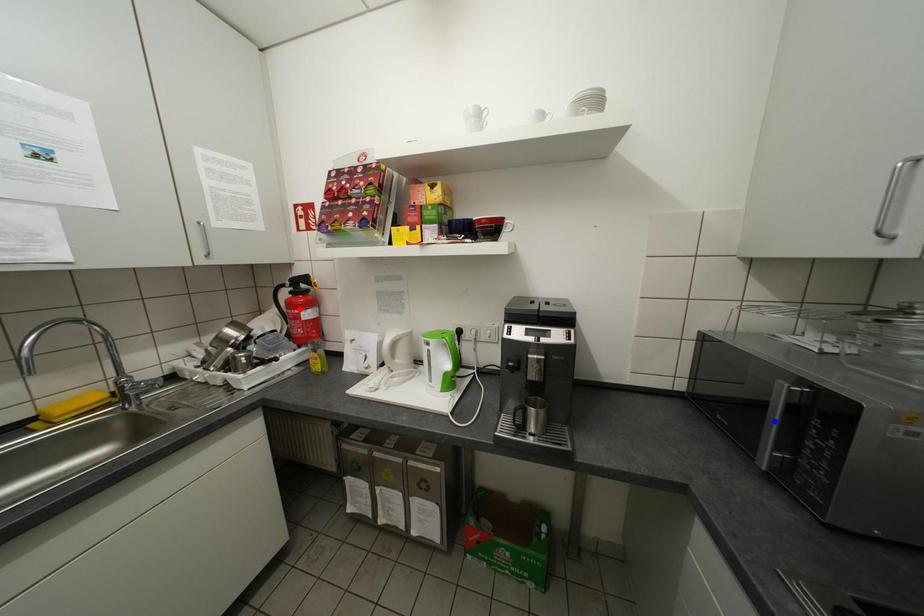
Question: Two points are marked on the image. Which point is closer to the camera?

Choices:
 (A) Blue point is closer.
 (B) Red point is closer.

Answer: (A)